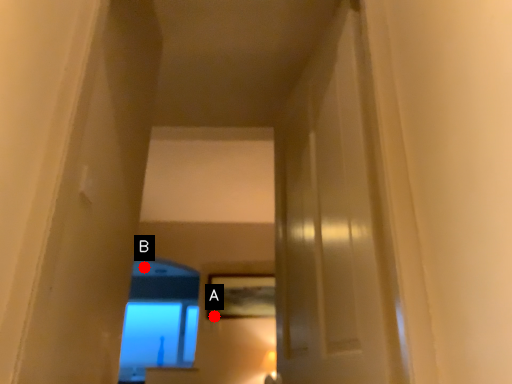
Question: Two points are circled on the image, labeled by A and B beside each circle. Which point is further to the camera?

Choices:
 (A) A is further
 (B) B is further

Answer: (B)